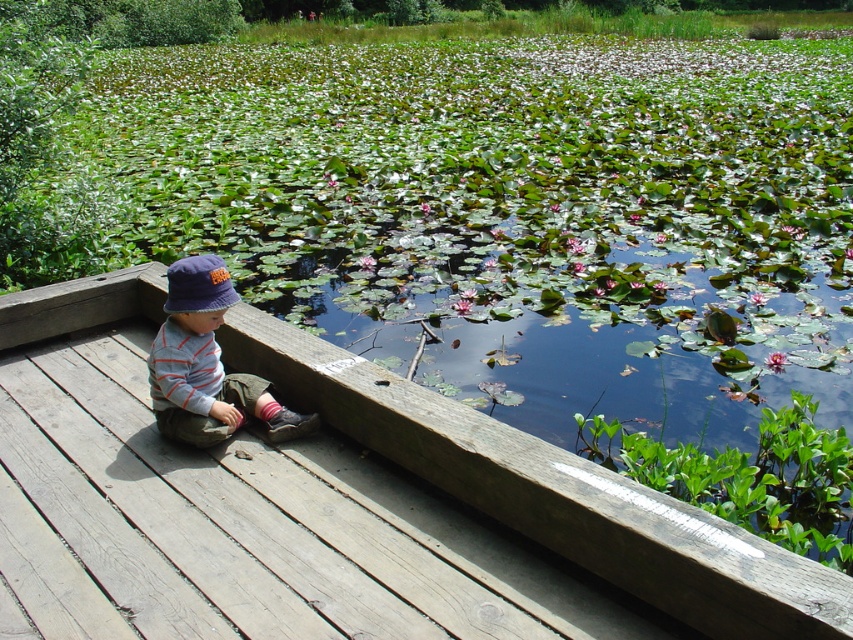
You are a parent trying to ensure your child stays safe while playing on the wooden deck at center and wearing the striped cotton shirt at left. Considering the deck width compared to the shirt, which object is wider?

The wooden deck at center is wider than the striped cotton shirt at left, as its width surpasses that of the shirt.

You are a photographer trying to capture the child in the scene. You notice the striped cotton shirt at left and the blue fabric hat at left. Which item should you focus on first if you want to frame the child from top to bottom?

The blue fabric hat at left is above the striped cotton shirt at left, so you should focus on the blue fabric hat at left first to frame the child from top to bottom.